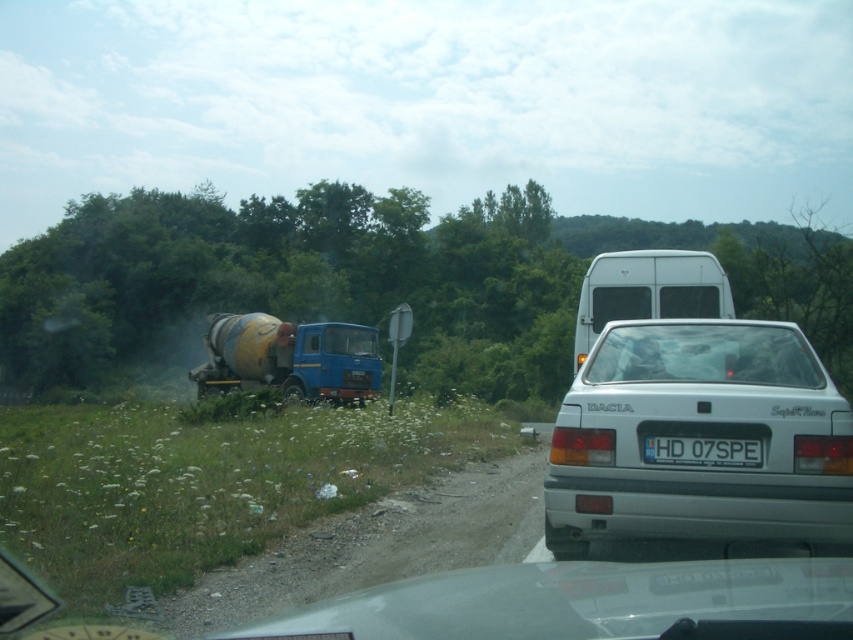
Based on the scene description, where is the white matte hatchback at center located in the image?

The white matte hatchback at center is located at point (699, 438).

You are a passenger in the vehicle and want to know how far the white matte hatchback at center is from you. Can you determine the distance using the information provided?

The white matte hatchback at center is 4.94 meters away from the camera, so the distance between you and the white matte hatchback at center is approximately 4.94 meters.

You are a delivery driver who needs to navigate through a narrow alley. Your vehicle has a turning radius of 3 meters. You see the white matte hatchback at center and the dirt gravel at lower left in the scene. Can you safely turn around using the space between them?

The white matte hatchback at center is 2.53 meters away from the dirt gravel at lower left. Since your vehicle requires a turning radius of 3 meters, the distance between them is insufficient. You need to find a wider space to turn around safely.